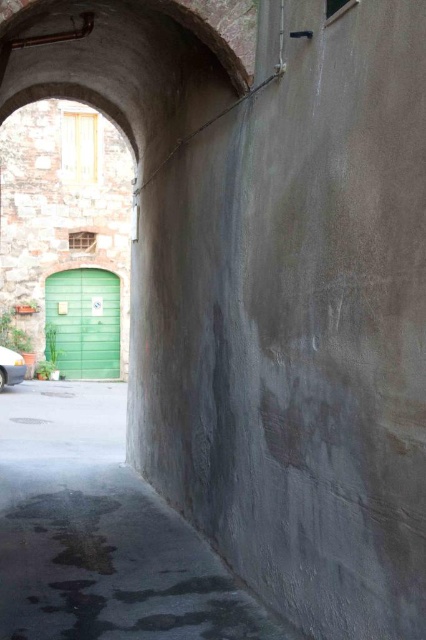
Is point (66, 356) closer to camera compared to point (13, 380)?

No, it is not.

Based on the photo, does green wooden door at left have a lesser width compared to white glossy car at lower left?

No.

Locate an element on the screen. green wooden door at left is located at coordinates point(83,323).